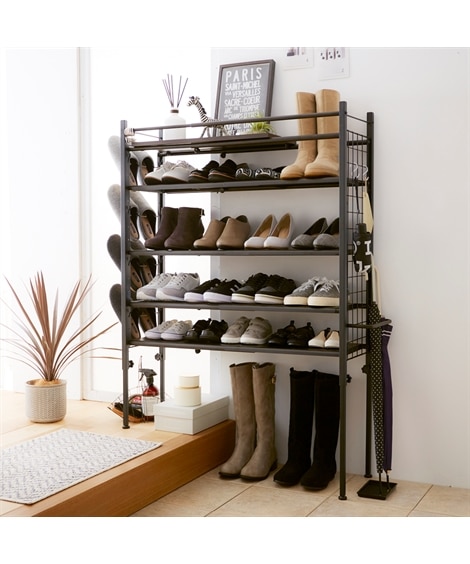
Where is `shoes on top shelf`? The height and width of the screenshot is (564, 470). shoes on top shelf is located at coordinates (329, 158), (299, 161), (270, 171), (245, 171), (220, 171), (201, 175), (177, 175), (160, 175).